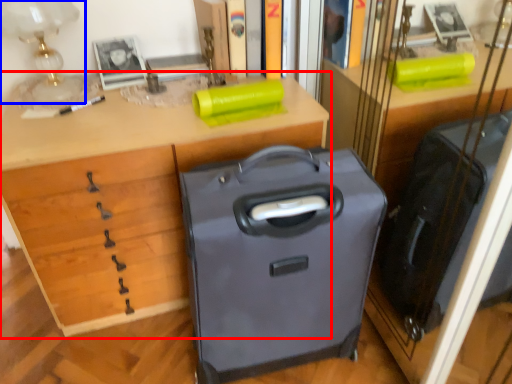
Question: Which object is closer to the camera taking this photo, desk (highlighted by a red box) or table lamp (highlighted by a blue box)?

Choices:
 (A) desk
 (B) table lamp

Answer: (A)